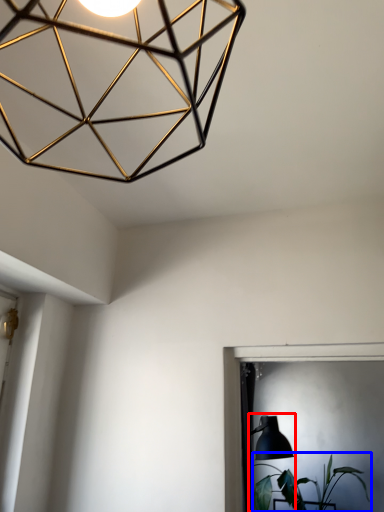
Question: Which of the following is the farthest to the observer, table lamp (highlighted by a red box) or houseplant (highlighted by a blue box)?

Choices:
 (A) table lamp
 (B) houseplant

Answer: (B)